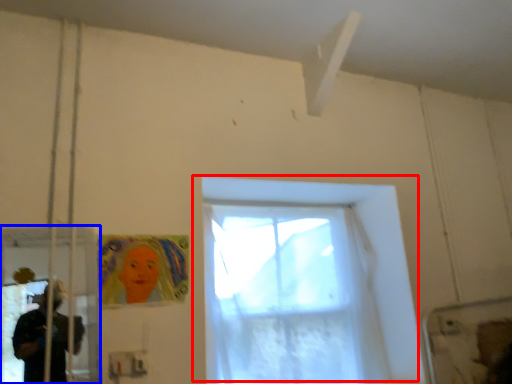
Question: Which object appears farthest to the camera in this image, window (highlighted by a red box) or screen door (highlighted by a blue box)?

Choices:
 (A) window
 (B) screen door

Answer: (A)